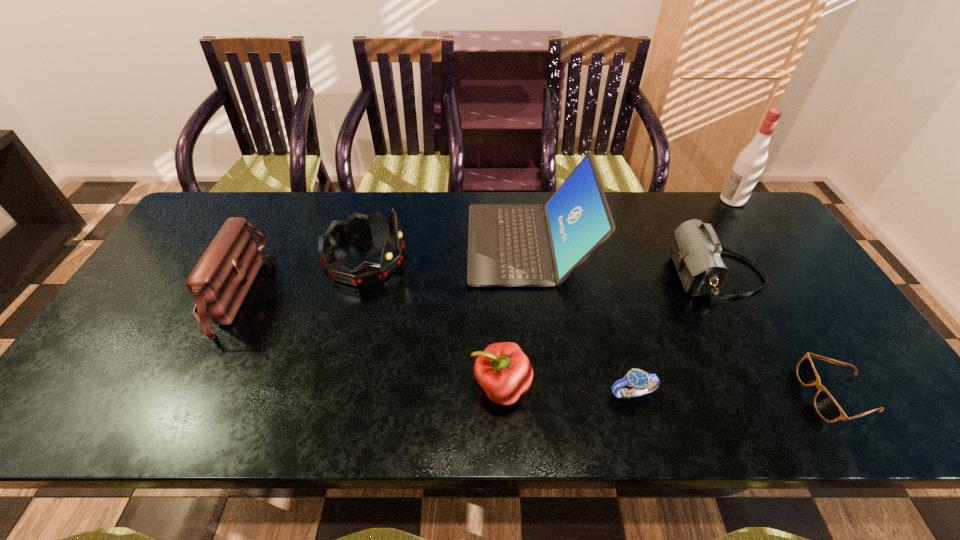
I want to click on shoulder bag located in the right edge section of the desktop, so click(696, 251).

The width and height of the screenshot is (960, 540). Identify the location of sunglasses present at the right edge. (826, 406).

I want to click on object located at the far right corner, so click(x=750, y=163).

At what (x,y) coordinates should I click in order to perform the action: click on object that is at the near right corner. Please return your answer as a coordinate pair (x, y). The image size is (960, 540). Looking at the image, I should click on (826, 406).

Locate an element on the screen. The height and width of the screenshot is (540, 960). blank space at the far edge is located at coordinates click(409, 239).

The height and width of the screenshot is (540, 960). In order to click on vacant space at the near edge in this screenshot , I will do `click(185, 412)`.

Locate an element on the screen. The height and width of the screenshot is (540, 960). blank space at the left edge of the desktop is located at coordinates (186, 281).

Identify the location of vacant space at the right edge of the desktop. (791, 254).

In the image, there is a desktop. Find the location of `vacant space at the far left corner`. vacant space at the far left corner is located at coordinates (256, 197).

The image size is (960, 540). In order to click on vacant region between the tiara and the laptop computer in this screenshot , I will do (447, 251).